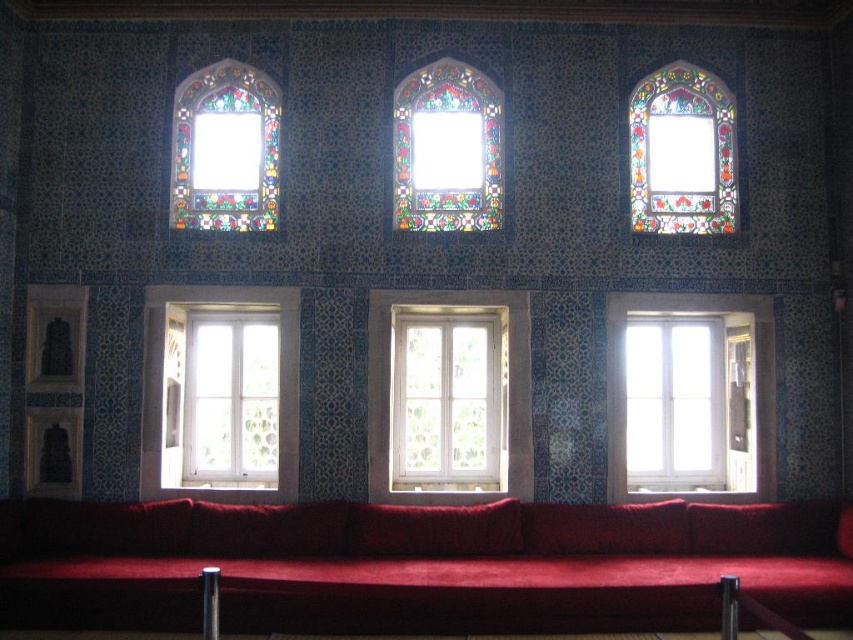
Looking at this image, which is below, velvet red couch at lower center or white glass window at left?

Positioned lower is velvet red couch at lower center.

Is point (634, 604) in front of point (173, 346)?

Yes.

Between point (782, 584) and point (164, 413), which one is positioned behind?

The point (164, 413) is behind.

Identify the location of velvet red couch at lower center. The height and width of the screenshot is (640, 853). [419, 564].

Can you confirm if white glass window at left is thinner than stained glass window at upper left?

Correct, white glass window at left's width is less than stained glass window at upper left's.

From the picture: Is white glass window at left shorter than stained glass window at upper left?

Incorrect, white glass window at left's height does not fall short of stained glass window at upper left's.

Between point (230, 442) and point (248, 154), which one is positioned behind?

The point (230, 442) is behind.

I want to click on white glass window at left, so (x=221, y=396).

Can you confirm if velvet red couch at lower center is shorter than stained glass window at upper right?

Yes.

Can you confirm if velvet red couch at lower center is thinner than stained glass window at upper right?

No.

Is point (103, 577) closer to viewer compared to point (639, 124)?

Yes, point (103, 577) is in front of point (639, 124).

Identify the location of velvet red couch at lower center. Image resolution: width=853 pixels, height=640 pixels. (419, 564).